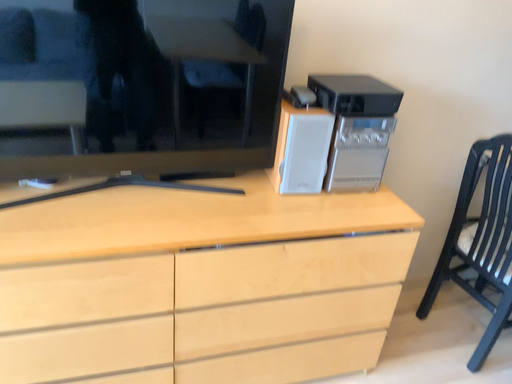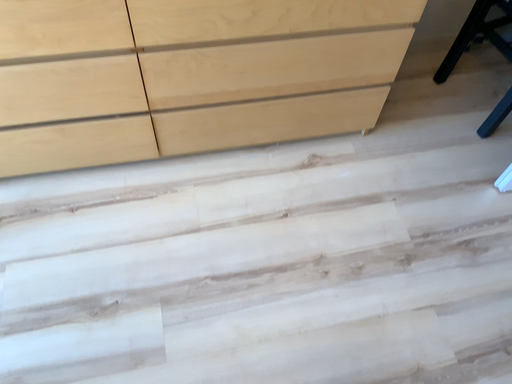
Question: How did the camera likely rotate when shooting the video?

Choices:
 (A) rotated downward
 (B) rotated upward

Answer: (A)